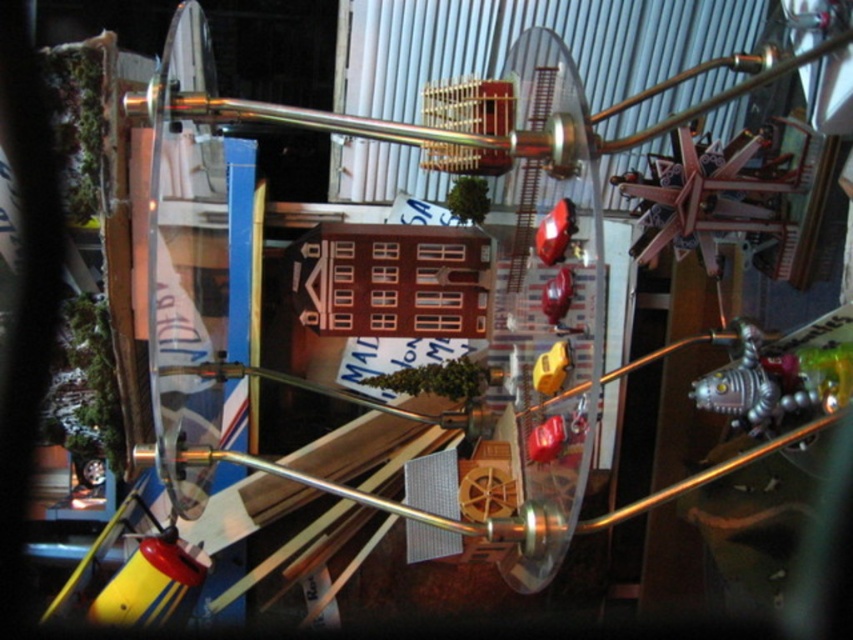
Does point (761, 148) come closer to viewer compared to point (538, 360)?

No.

Does metallic silver star at upper right appear on the left side of yellow plastic toy at center?

No, metallic silver star at upper right is not to the left of yellow plastic toy at center.

Is point (741, 145) more distant than point (563, 346)?

Yes, point (741, 145) is farther from viewer.

Locate an element on the screen. metallic silver star at upper right is located at coordinates [717, 195].

Between metallic silver star at upper right and glossy plastic apple at center, which one has more height?

With more height is metallic silver star at upper right.

Does metallic silver star at upper right come in front of glossy plastic apple at center?

No, metallic silver star at upper right is behind glossy plastic apple at center.

What are the coordinates of `metallic silver star at upper right` in the screenshot? It's located at (717, 195).

Who is shorter, glossy plastic car at center or glossy plastic apple at center?

Standing shorter between the two is glossy plastic apple at center.

Locate an element on the screen. This screenshot has width=853, height=640. glossy plastic car at center is located at coordinates (555, 232).